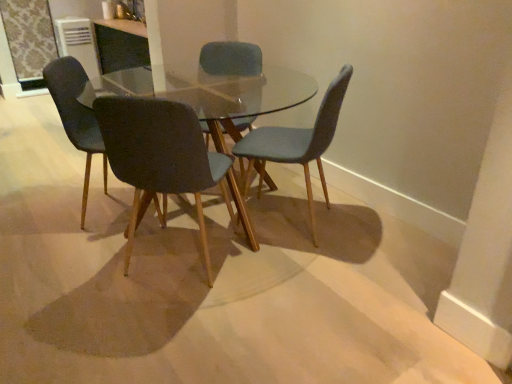
I want to click on vacant space in between clear glass table at center and matte black chair at center, marked as the 3th chair in a right-to-left arrangement, so click(x=185, y=258).